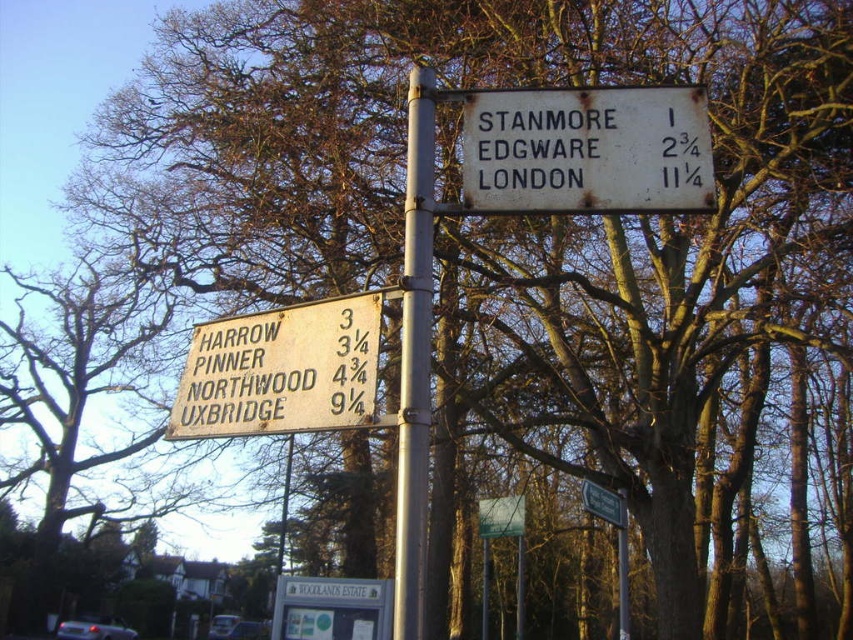
Question: Estimate the real-world distances between objects in this image. Which object is farther from the green plastic street sign at center?

Choices:
 (A) white wooden sign at lower left
 (B) brown wooden sign at lower left

Answer: (A)

Question: Can you confirm if rusty metal sign at upper center is smaller than white plastic sign at lower center?

Choices:
 (A) no
 (B) yes

Answer: (A)

Question: Does white wooden sign at lower left have a larger size compared to brown wooden sign at lower left?

Choices:
 (A) yes
 (B) no

Answer: (A)

Question: Which point appears farthest from the camera in this image?

Choices:
 (A) (254, 380)
 (B) (619, 499)
 (C) (416, 580)

Answer: (B)

Question: Which of these objects is positioned closest to the white wooden sign at lower left?

Choices:
 (A) rusty metal sign at upper center
 (B) white plastic sign at lower center

Answer: (A)

Question: Does white wooden sign at lower left have a smaller size compared to brown wooden sign at lower left?

Choices:
 (A) yes
 (B) no

Answer: (B)